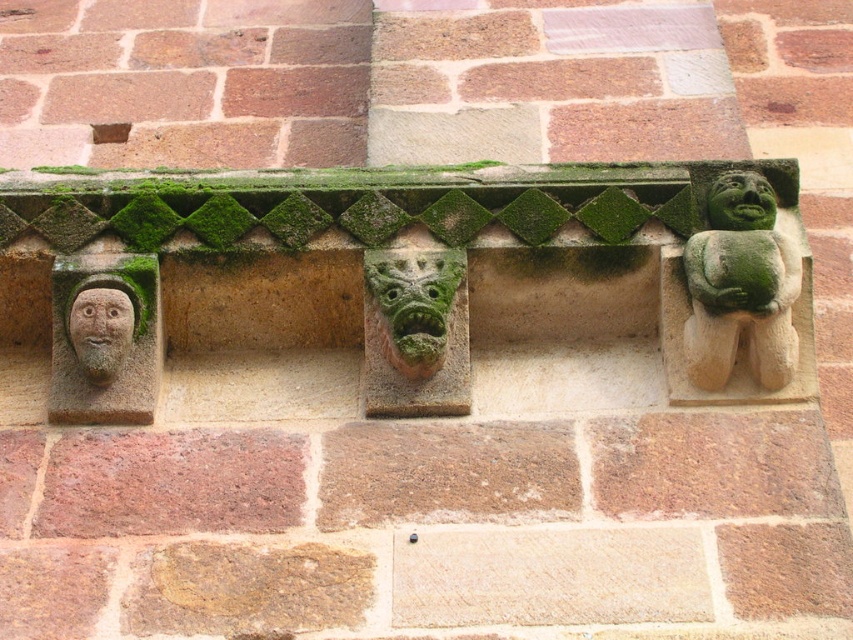
Is green stone gargoyle at center smaller than smooth stone face at left?

Incorrect, green stone gargoyle at center is not smaller in size than smooth stone face at left.

Which is in front, point (416, 380) or point (109, 374)?

Point (109, 374)

Image resolution: width=853 pixels, height=640 pixels. I want to click on green stone gargoyle at center, so click(x=415, y=332).

Does point (753, 298) come closer to viewer compared to point (724, 198)?

Yes, point (753, 298) is closer to viewer.

Does point (772, 205) lie behind point (740, 202)?

Yes.

Where is `green stone figure at right`? The width and height of the screenshot is (853, 640). green stone figure at right is located at coordinates (740, 285).

Which is more to the right, green stone gargoyle at center or green stone face at upper right?

From the viewer's perspective, green stone face at upper right appears more on the right side.

Can you confirm if green stone gargoyle at center is positioned above green stone face at upper right?

Incorrect, green stone gargoyle at center is not positioned above green stone face at upper right.

Identify the location of green stone gargoyle at center. This screenshot has width=853, height=640. (415, 332).

Find the location of a particular element. green stone gargoyle at center is located at coordinates (415, 332).